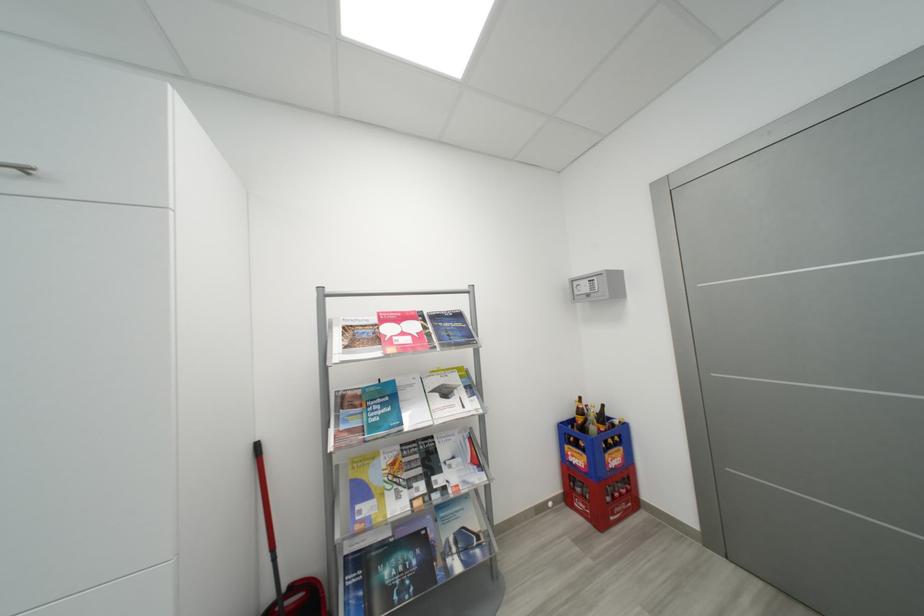
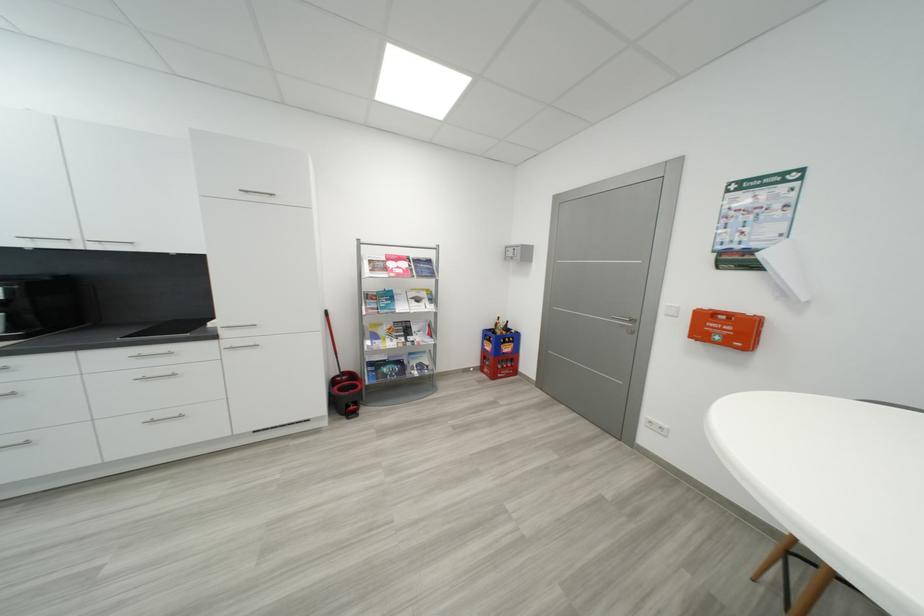
Question: In a continuous first-person perspective shot, in which direction is the camera moving?

Choices:
 (A) Left
 (B) Right
 (C) Forward
 (D) Backward

Answer: (D)